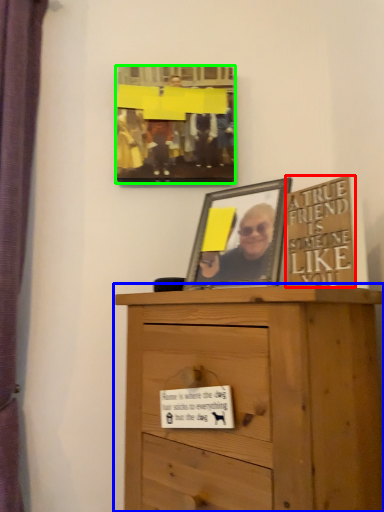
Question: Which object is the farthest from writing (highlighted by a red box)? Choose among these: chest of drawers (highlighted by a blue box) or picture frame (highlighted by a green box).

Choices:
 (A) chest of drawers
 (B) picture frame

Answer: (B)